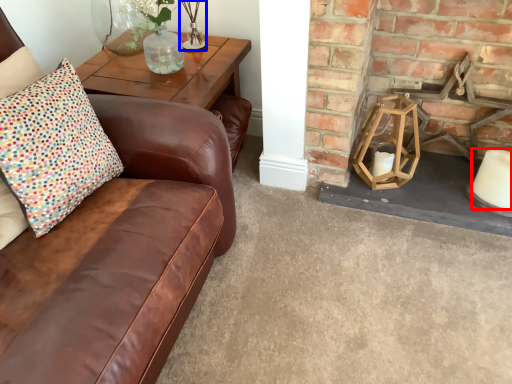
Question: Which of the following is the farthest to the observer, candle (highlighted by a red box) or candle holder (highlighted by a blue box)?

Choices:
 (A) candle
 (B) candle holder

Answer: (B)